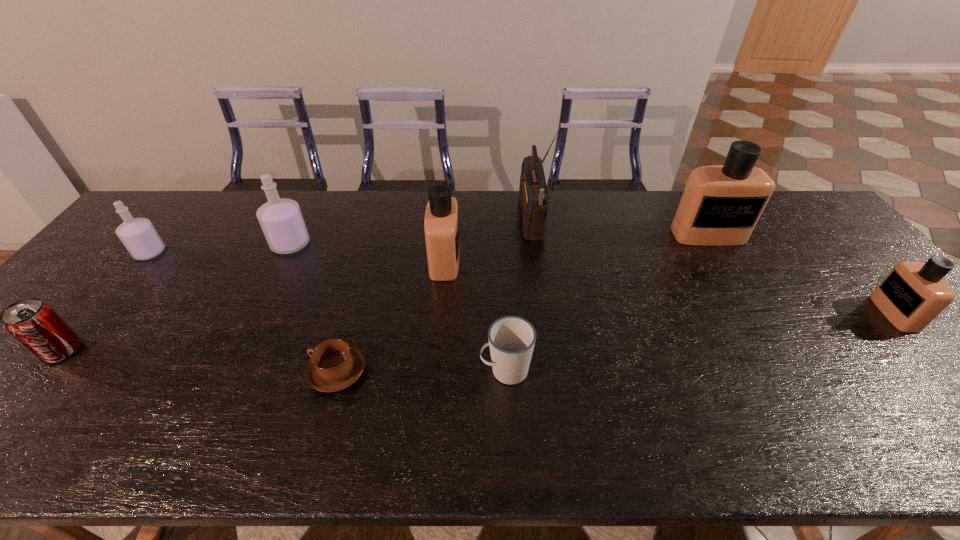
Where is `free point located on the front label of the second tallest object`? Image resolution: width=960 pixels, height=540 pixels. free point located on the front label of the second tallest object is located at coordinates pos(724,262).

This screenshot has height=540, width=960. I want to click on free space located on the right of the bigger purple perfume, so click(382, 244).

Where is `vacant space situated on the front label of the fifth object from left to right`? This screenshot has height=540, width=960. vacant space situated on the front label of the fifth object from left to right is located at coordinates (589, 260).

The width and height of the screenshot is (960, 540). I want to click on vacant space located on the front label of the rightmost object, so click(x=801, y=313).

Identify the location of vacant space located on the front label of the rightmost object. The width and height of the screenshot is (960, 540). (797, 313).

Where is `free space located 0.390m on the front label of the rightmost object`? The width and height of the screenshot is (960, 540). free space located 0.390m on the front label of the rightmost object is located at coordinates (732, 313).

Image resolution: width=960 pixels, height=540 pixels. I want to click on free space located on the front of the left purple perfume, so click(x=115, y=294).

I want to click on free spot located on the back of the red pop soda, so click(130, 270).

Find the location of a particular element. free location located 0.050m with a handle on the side of the cup is located at coordinates (458, 370).

Image resolution: width=960 pixels, height=540 pixels. What are the coordinates of `free point located 0.220m with a handle on the side of the cup` in the screenshot? It's located at (385, 370).